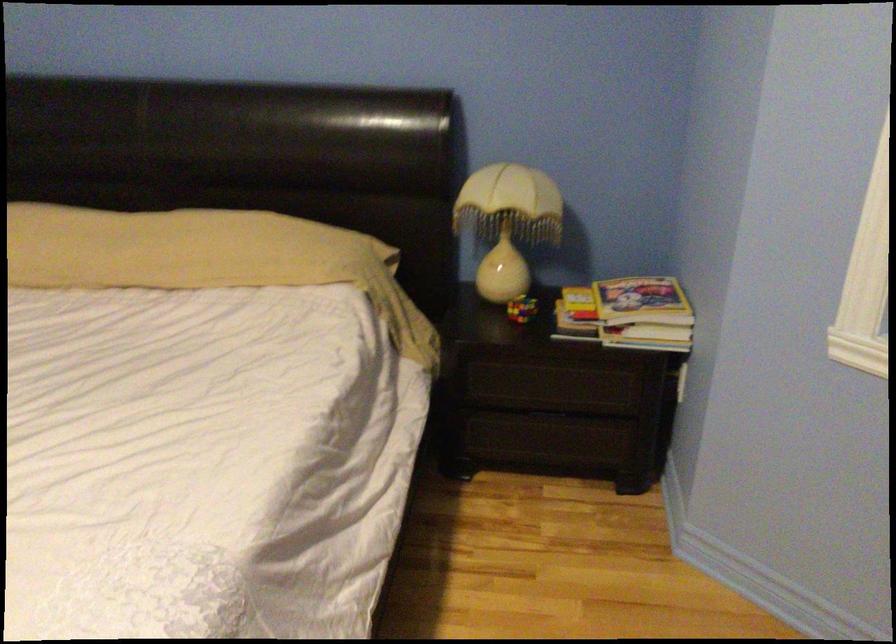
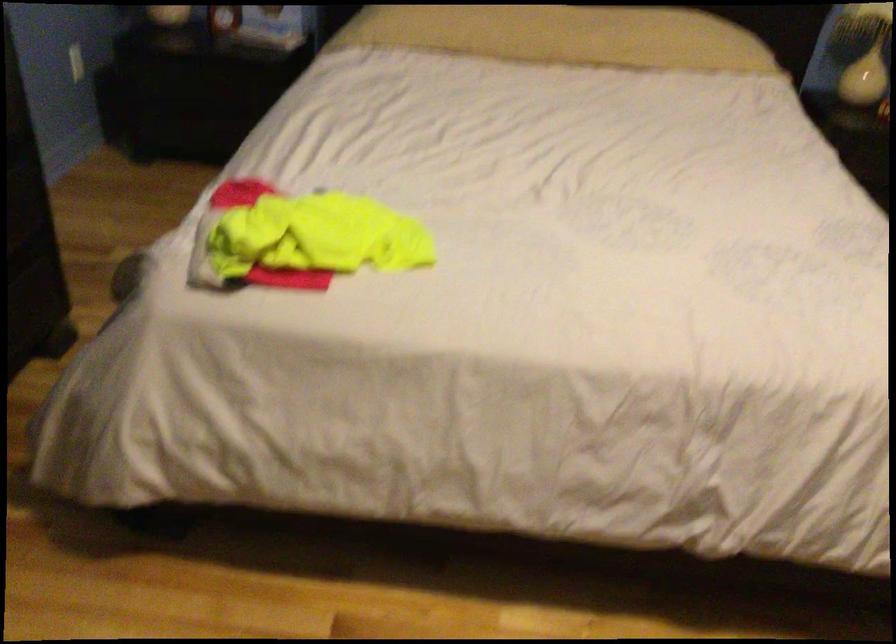
In a continuous first-person perspective shot, in which direction is the camera moving?

The cameraman walked toward left, backward.